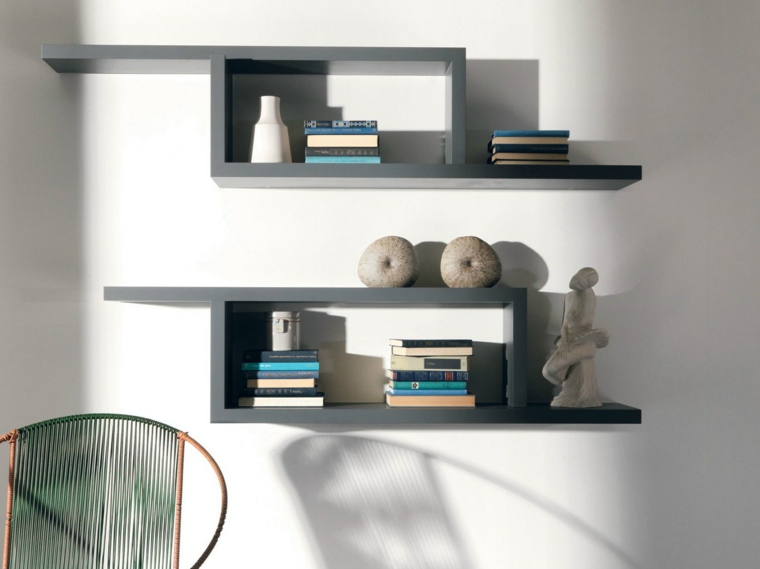
What are the coordinates of `book in left stack bottom shelf` in the screenshot? It's located at pos(298,357), pos(283,366), pos(286,374), pos(296,382), pos(302,391), pos(287,402).